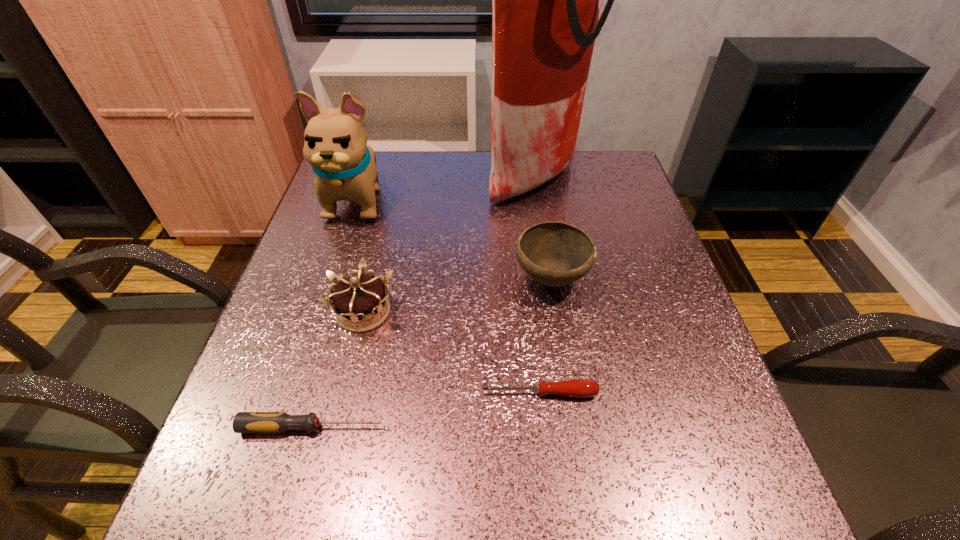
Locate an element on the screen. The height and width of the screenshot is (540, 960). object that is at the far left corner is located at coordinates (335, 144).

Locate an element on the screen. object located at the far right corner is located at coordinates (546, 0).

Where is `vacant space at the far edge of the desktop`? The image size is (960, 540). vacant space at the far edge of the desktop is located at coordinates (431, 157).

Find the location of a particular element. vacant region at the left edge is located at coordinates (326, 329).

I want to click on vacant area at the right edge, so click(705, 458).

Locate an element on the screen. The image size is (960, 540). vacant point at the near left corner is located at coordinates (238, 510).

This screenshot has height=540, width=960. I want to click on free space at the far right corner of the desktop, so click(x=616, y=183).

The width and height of the screenshot is (960, 540). Identify the location of vacant area at the near right corner of the desktop. (724, 501).

At what (x,y) coordinates should I click in order to perform the action: click on free spot between the crown and the fifth shortest object. Please return your answer as a coordinate pair (x, y). Looking at the image, I should click on (360, 255).

The width and height of the screenshot is (960, 540). In order to click on blank region between the second tallest object and the left screwdriver in this screenshot , I will do [x=335, y=313].